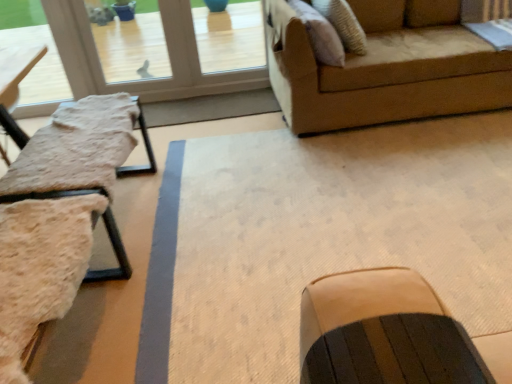
Question: Do you think fuzzy fabric table at left is within transparent glass door at upper left, or outside of it?

Choices:
 (A) inside
 (B) outside

Answer: (B)

Question: Is point (8, 114) closer or farther from the camera than point (133, 72)?

Choices:
 (A) farther
 (B) closer

Answer: (B)

Question: Which of these objects is positioned closest to the suede-like beige pillow at upper right?

Choices:
 (A) beige fabric swivel chair at left
 (B) dark brown leather rocking chair at center
 (C) transparent glass door at upper left
 (D) fuzzy fabric table at left

Answer: (D)

Question: Estimate the real-world distances between objects in this image. Which object is closer to the beige fabric swivel chair at left?

Choices:
 (A) transparent glass door at upper left
 (B) dark brown leather rocking chair at center
 (C) suede-like beige pillow at upper right
 (D) fuzzy fabric table at left

Answer: (D)